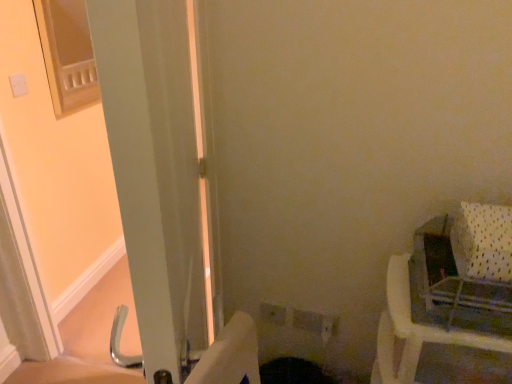
This screenshot has width=512, height=384. In order to click on white plastic chair at right in this screenshot , I will do `click(414, 330)`.

This screenshot has height=384, width=512. Describe the element at coordinates (466, 267) in the screenshot. I see `white plastic baby carriage at right` at that location.

Where is `white glossy screen door at left`? The height and width of the screenshot is (384, 512). white glossy screen door at left is located at coordinates (156, 170).

From the picture: Is white plastic chair at right positioned beyond the bounds of white glossy screen door at left?

Yes.

From a real-world perspective, is white plastic chair at right above or below white glossy screen door at left?

In terms of real-world spatial position, white plastic chair at right is below white glossy screen door at left.

Which of these two, white plastic chair at right or white glossy screen door at left, is bigger?

white glossy screen door at left.

Is white plastic chair at right oriented towards white glossy screen door at left?

Yes.

Is white plastic baby carriage at right facing away from white glossy screen door at left?

No, white plastic baby carriage at right is not facing the opposite direction of white glossy screen door at left.

From the picture: Is white plastic baby carriage at right situated inside white glossy screen door at left or outside?

white plastic baby carriage at right is outside white glossy screen door at left.

Considering the positions of objects white plastic baby carriage at right and white glossy screen door at left in the image provided, who is behind, white plastic baby carriage at right or white glossy screen door at left?

white plastic baby carriage at right is more distant.

Which object is closer to the camera taking this photo, white glossy screen door at left or white plastic chair at right?

white glossy screen door at left is in front.

Based on the photo, how much distance is there between white glossy screen door at left and white plastic chair at right?

A distance of 22.48 inches exists between white glossy screen door at left and white plastic chair at right.

From the image's perspective, between white glossy screen door at left and white plastic chair at right, who is located below?

white plastic chair at right is shown below in the image.

Is white glossy screen door at left oriented away from white plastic chair at right?

That's right, white glossy screen door at left is facing away from white plastic chair at right.

From the picture: Which is more to the right, white glossy screen door at left or white plastic baby carriage at right?

Positioned to the right is white plastic baby carriage at right.

Is white glossy screen door at left aimed at white plastic baby carriage at right?

Yes, white glossy screen door at left is facing white plastic baby carriage at right.

From the picture: Is white glossy screen door at left wider than white plastic baby carriage at right?

No.

This screenshot has width=512, height=384. I want to click on baby carriage above the white plastic chair at right (from a real-world perspective), so click(466, 267).

Would you consider white plastic chair at right to be distant from white plastic baby carriage at right?

No, white plastic chair at right is not far from white plastic baby carriage at right.

In terms of width, does white plastic chair at right look wider or thinner when compared to white plastic baby carriage at right?

Clearly, white plastic chair at right has more width compared to white plastic baby carriage at right.

Considering the relative sizes of white plastic baby carriage at right and white plastic chair at right in the image provided, is white plastic baby carriage at right smaller than white plastic chair at right?

Indeed, white plastic baby carriage at right has a smaller size compared to white plastic chair at right.

From a real-world perspective, who is located higher, white plastic baby carriage at right or white plastic chair at right?

white plastic baby carriage at right.

Does white plastic baby carriage at right turn towards white plastic chair at right?

No, white plastic baby carriage at right is not aimed at white plastic chair at right.

The image size is (512, 384). In the image, there is a white glossy screen door at left. What are the coordinates of `furniture below it (from the image's perspective)` in the screenshot? It's located at (414, 330).

Where is `baby carriage located above the white glossy screen door at left (from the image's perspective)`? baby carriage located above the white glossy screen door at left (from the image's perspective) is located at coordinates (466, 267).

From the image, which object appears to be nearer to white plastic baby carriage at right, white glossy screen door at left or white plastic chair at right?

white plastic chair at right.

Considering their positions, is white glossy screen door at left positioned further to white plastic chair at right than white plastic baby carriage at right?

white glossy screen door at left is further to white plastic chair at right.

Based on their spatial positions, is white plastic baby carriage at right or white plastic chair at right further from white glossy screen door at left?

white plastic baby carriage at right lies further to white glossy screen door at left than the other object.

When comparing their distances from white plastic chair at right, does white plastic baby carriage at right or white glossy screen door at left seem closer?

white plastic baby carriage at right.

Based on their spatial positions, is white plastic chair at right or white glossy screen door at left further from white plastic baby carriage at right?

Among the two, white glossy screen door at left is located further to white plastic baby carriage at right.

In the scene shown: From the image, which object appears to be nearer to white glossy screen door at left, white plastic chair at right or white plastic baby carriage at right?

white plastic chair at right is positioned closer to the anchor white glossy screen door at left.

Locate an element on the screen. This screenshot has width=512, height=384. baby carriage between white glossy screen door at left and white plastic chair at right is located at coordinates (466, 267).